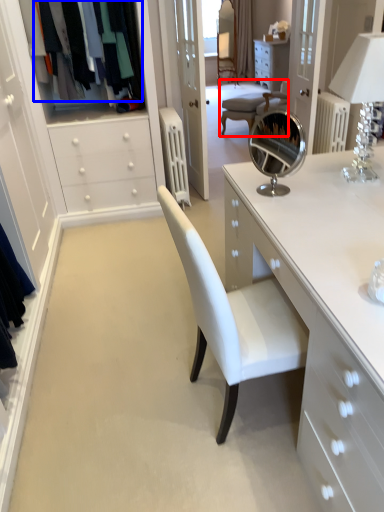
Question: Which of the following is the farthest to the observer, chair (highlighted by a red box) or clothing (highlighted by a blue box)?

Choices:
 (A) chair
 (B) clothing

Answer: (A)